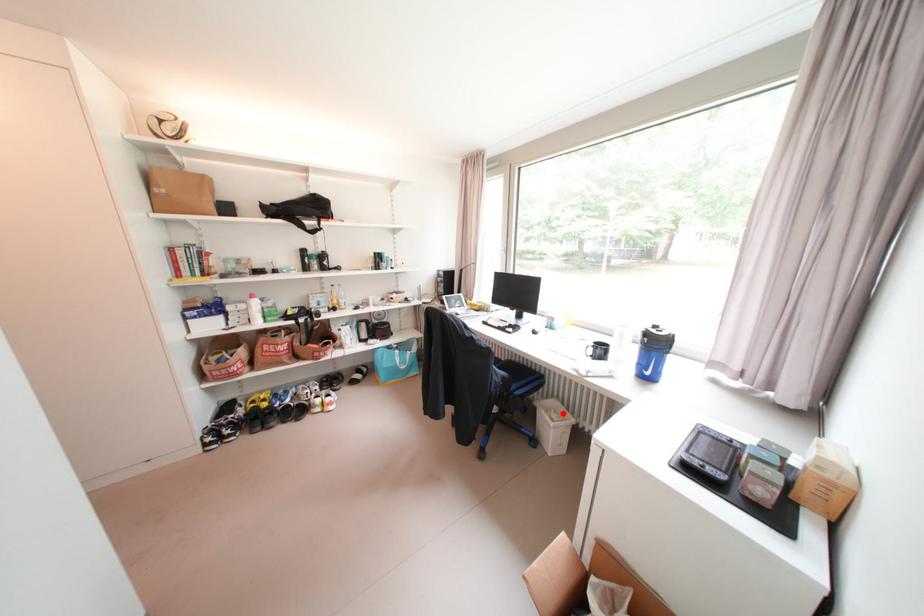
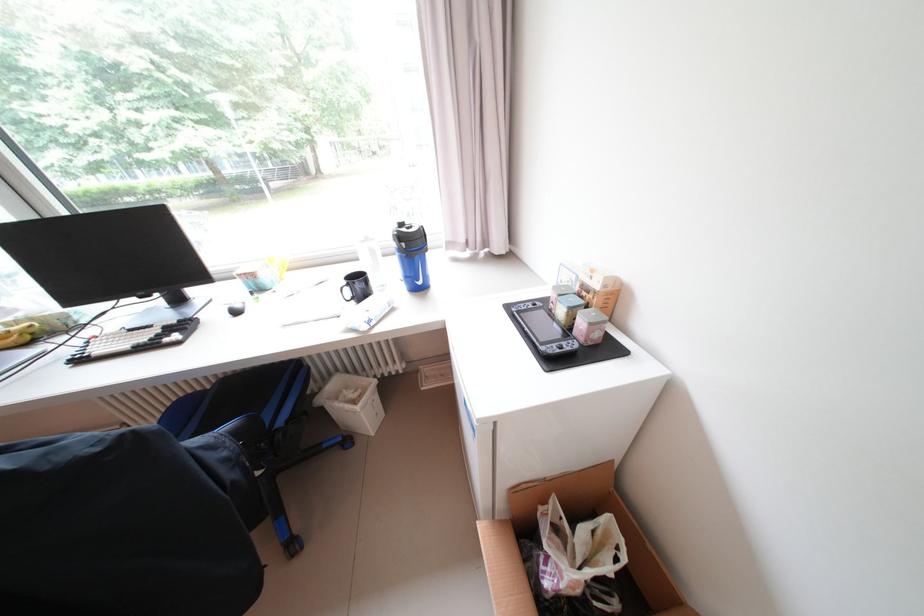
Find the pixel in the second image that matches the highlighted location in the first image.

(355, 391)